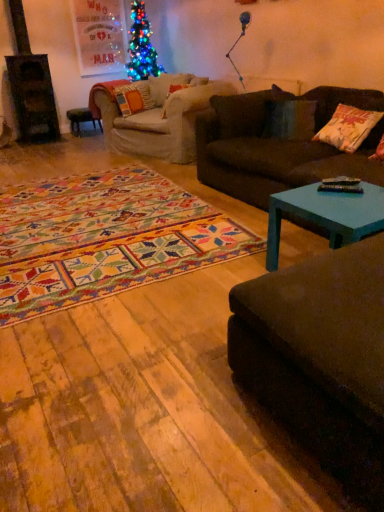
The height and width of the screenshot is (512, 384). I want to click on free location to the left of velvet dark brown couch at lower right, placed as the 1th studio couch when sorted from bottom to top, so click(x=164, y=389).